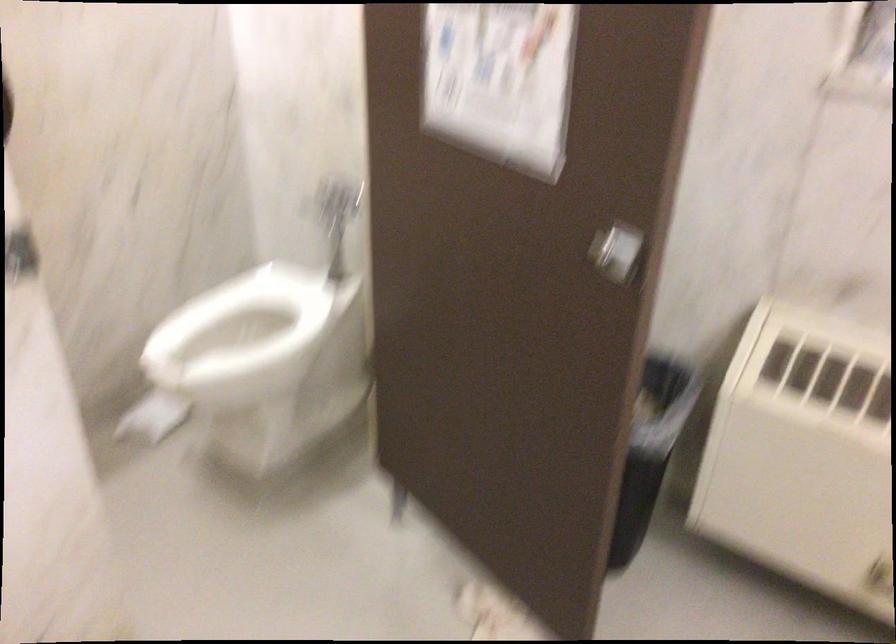
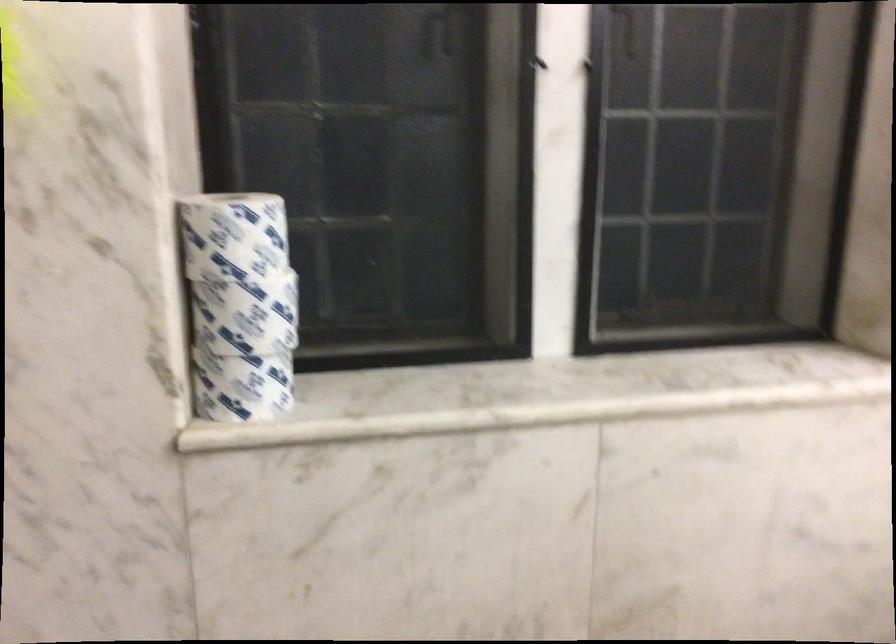
Question: The images are taken continuously from a first-person perspective. In which direction is your viewpoint rotating?

Choices:
 (A) Left
 (B) Right
 (C) Up
 (D) Down

Answer: (B)